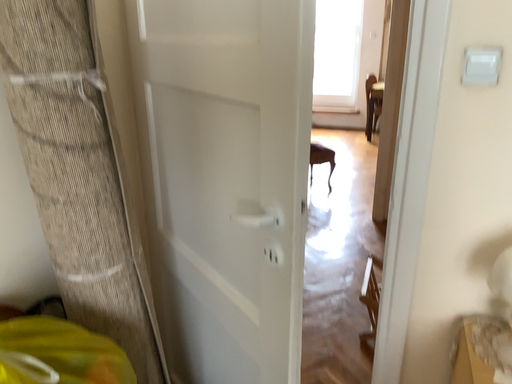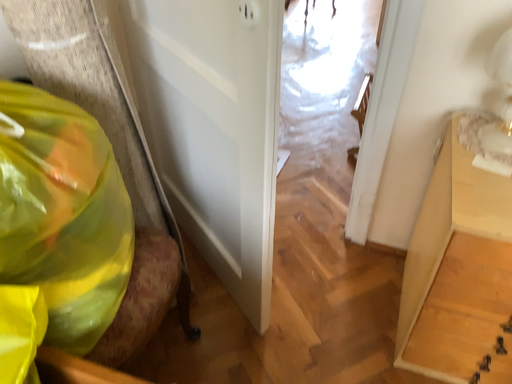
Question: How did the camera likely rotate when shooting the video?

Choices:
 (A) rotated upward
 (B) rotated downward

Answer: (B)